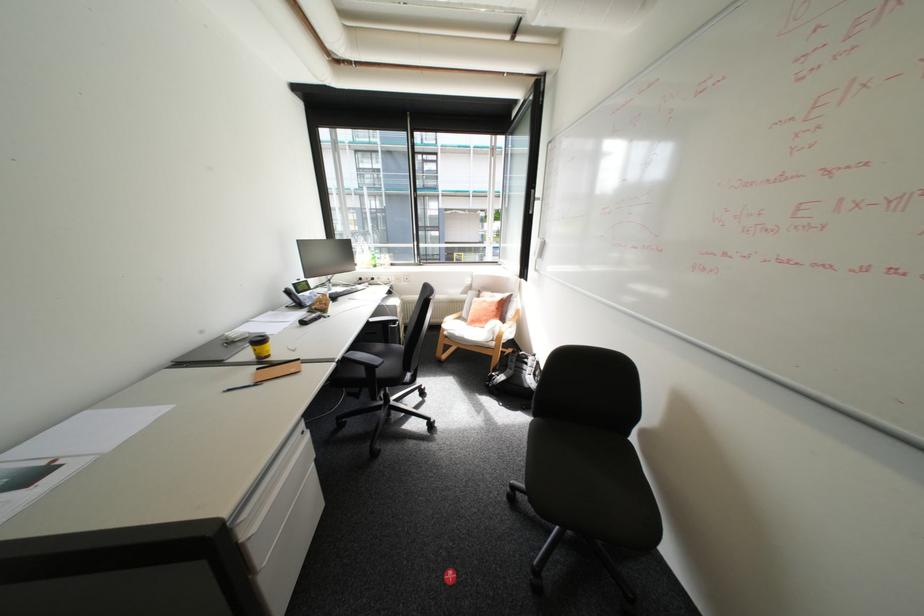
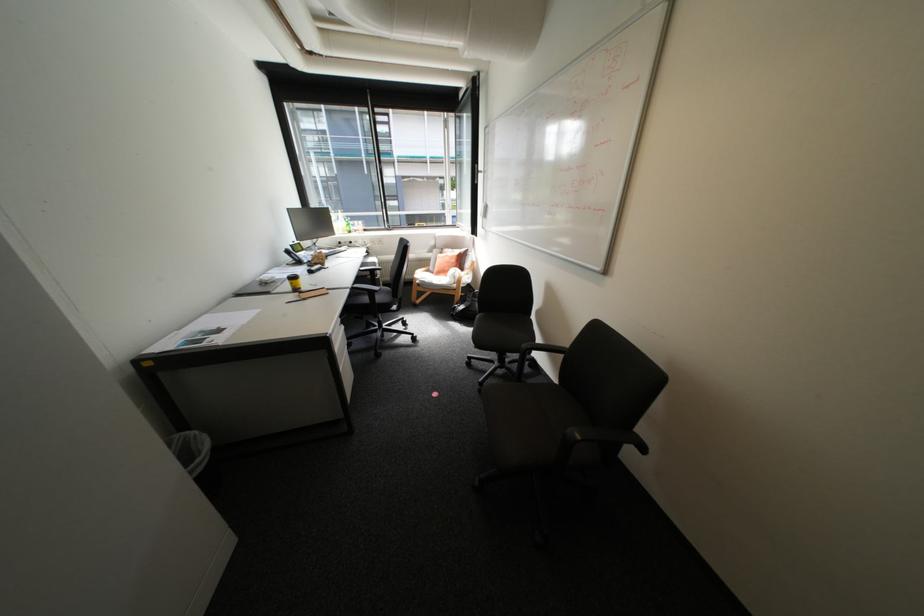
In the second image, find the point that corresponds to pixel 514 408 in the first image.

(473, 326)